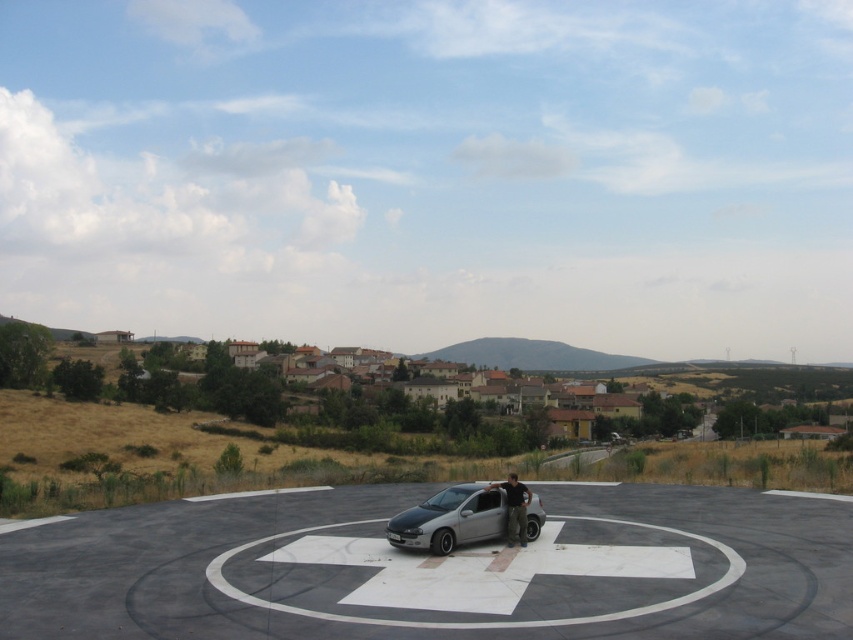
You are a drone operator trying to land a helicopter on the helipad. The helipad has a concrete circle at center and a dark gray fabric pants at center. Which object should you avoid placing the helicopter on to ensure a safe landing?

You should avoid placing the helicopter on the dark gray fabric pants at center because the concrete circle at center is located below it, meaning the pants are not part of the landing area and could be an obstacle.

You are a delivery drone operator. Your drone has to land on the helipad while avoiding obstacles. You see the silver metallic car at center and the dark gray fabric pants at center. Which object is wider, and should you adjust your landing path to avoid it?

The silver metallic car at center is wider than the dark gray fabric pants at center. You should adjust your landing path to avoid the silver metallic car at center since it is wider and poses a greater obstruction.